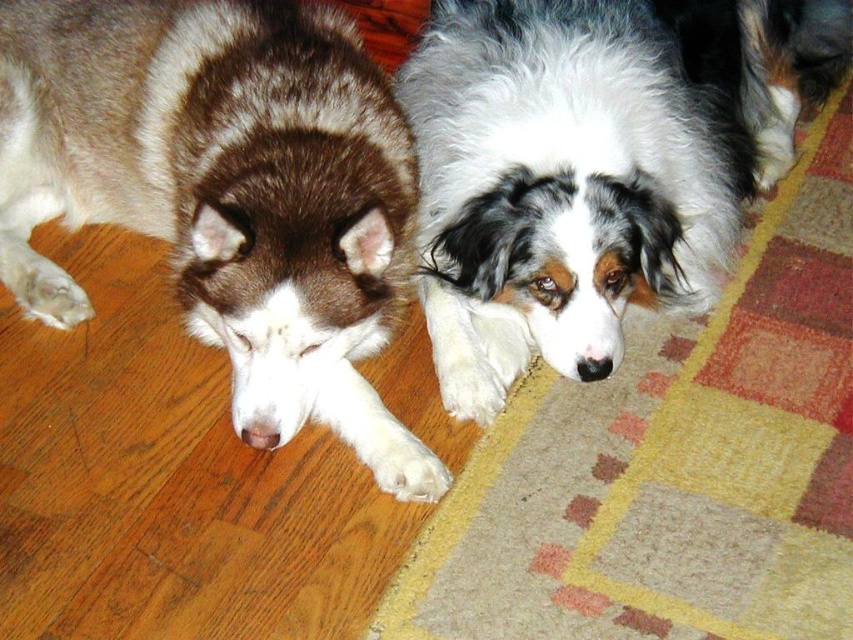
Question: Can you confirm if brown and white fur at left is positioned to the left of white fluffy dog at center?

Choices:
 (A) no
 (B) yes

Answer: (B)

Question: From the image, what is the correct spatial relationship of brown and white fur at left in relation to white fluffy dog at center?

Choices:
 (A) right
 (B) left

Answer: (B)

Question: Which object is closer to the camera taking this photo?

Choices:
 (A) brown and white fur at left
 (B) white fluffy dog at center

Answer: (A)

Question: Is brown and white fur at left below white fluffy dog at center?

Choices:
 (A) yes
 (B) no

Answer: (A)

Question: Which point is closer to the camera?

Choices:
 (A) (416, 72)
 (B) (347, 172)

Answer: (B)